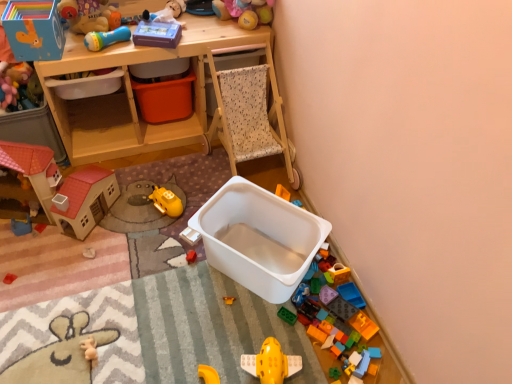
The height and width of the screenshot is (384, 512). What do you see at coordinates (132, 93) in the screenshot?
I see `wooden desk at upper center` at bounding box center [132, 93].

Image resolution: width=512 pixels, height=384 pixels. What do you see at coordinates (34, 130) in the screenshot?
I see `matte plastic storage box at left, the fourth storage box from the right` at bounding box center [34, 130].

Find the location of a particular element. matte plastic playhouse at left, positioned as the 4th toy in top-to-bottom order is located at coordinates (63, 188).

Describe the element at coordinates (21, 227) in the screenshot. The image size is (512, 384). I see `blue plastic toy at left, which appears as the fifth toy when viewed from the top` at that location.

Locate an element on the screen. orange plastic storage box at center, which ranks as the second storage box in right-to-left order is located at coordinates (165, 99).

Describe the element at coordinates (339, 273) in the screenshot. The width and height of the screenshot is (512, 384). I see `translucent plastic blocks at lower right, marked as the sixth toy in a top-to-bottom arrangement` at that location.

Measure the distance between matte cardboard box at upper left, which is the 3th toy from left to right, and camera.

They are 4.78 feet apart.

The height and width of the screenshot is (384, 512). I want to click on rubberized plastic rattle at upper left, the second toy from the top, so click(106, 38).

Is orange plastic storage box at center, which ranks as the third storage box in left-to-right order, placed right next to translucent plastic blocks at lower right, which ranks as the third toy in right-to-left order?

No, orange plastic storage box at center, which ranks as the third storage box in left-to-right order, is not in contact with translucent plastic blocks at lower right, which ranks as the third toy in right-to-left order.

Is orange plastic storage box at center, which ranks as the second storage box in right-to-left order, smaller than translucent plastic blocks at lower right, marked as the sixth toy in a top-to-bottom arrangement?

No.

Between point (142, 83) and point (328, 270), which one is positioned behind?

Positioned behind is point (142, 83).

How different are the orientations of orange plastic storage box at center, which ranks as the second storage box in right-to-left order, and translucent plastic blocks at lower right, marked as the sixth toy in a top-to-bottom arrangement, in degrees?

87.6 degrees.

Does orange plastic storage box at center, which ranks as the third storage box in left-to-right order, turn towards matte plastic playhouse at left, which is the 7th toy from bottom to top?

No, orange plastic storage box at center, which ranks as the third storage box in left-to-right order, is not aimed at matte plastic playhouse at left, which is the 7th toy from bottom to top.

Between orange plastic storage box at center, which ranks as the second storage box in right-to-left order, and matte plastic playhouse at left, marked as the 2th toy in a left-to-right arrangement, which one is positioned behind?

Positioned behind is orange plastic storage box at center, which ranks as the second storage box in right-to-left order.

Do you think orange plastic storage box at center, which ranks as the second storage box in right-to-left order, is within matte plastic playhouse at left, positioned as the 4th toy in top-to-bottom order, or outside of it?

orange plastic storage box at center, which ranks as the second storage box in right-to-left order, is outside matte plastic playhouse at left, positioned as the 4th toy in top-to-bottom order.

Does point (182, 102) come behind point (73, 232)?

Yes, it is behind point (73, 232).

Is white plastic container at lower center, the first storage box when ordered from right to left, aimed at rubberized plastic rattle at upper left, the fourth toy when ordered from left to right?

No, white plastic container at lower center, the first storage box when ordered from right to left, is not aimed at rubberized plastic rattle at upper left, the fourth toy when ordered from left to right.

Between white plastic container at lower center, the fourth storage box positioned from the left, and rubberized plastic rattle at upper left, the fourth toy when ordered from left to right, which one is positioned behind?

rubberized plastic rattle at upper left, the fourth toy when ordered from left to right.

Which point is more forward, (259,222) or (112,39)?

The point (112,39) is in front.

Does translucent plastic blocks at lower right, the 8th toy from the left, have a larger size compared to white plastic container at center-left, which is the 3th storage box in right-to-left order?

Incorrect, translucent plastic blocks at lower right, the 8th toy from the left, is not larger than white plastic container at center-left, which is the 3th storage box in right-to-left order.

Looking at this image, is translucent plastic blocks at lower right, marked as the sixth toy in a top-to-bottom arrangement, positioned far away from white plastic container at center-left, marked as the second storage box in a left-to-right arrangement?

Yes.

Would you say translucent plastic blocks at lower right, marked as the sixth toy in a top-to-bottom arrangement, is outside white plastic container at center-left, marked as the second storage box in a left-to-right arrangement?

Absolutely, translucent plastic blocks at lower right, marked as the sixth toy in a top-to-bottom arrangement, is external to white plastic container at center-left, marked as the second storage box in a left-to-right arrangement.

Which point is more distant from viewer, (215, 11) or (356, 289)?

Point (215, 11)

Is soft plush toy at upper center, acting as the tenth toy starting from the bottom, wider than translucent plastic toy blocks at lower right, positioned as the 7th toy in top-to-bottom order?

Yes, soft plush toy at upper center, acting as the tenth toy starting from the bottom, is wider than translucent plastic toy blocks at lower right, positioned as the 7th toy in top-to-bottom order.

From a real-world perspective, who is located higher, soft plush toy at upper center, acting as the tenth toy starting from the bottom, or translucent plastic toy blocks at lower right, placed as the 4th toy when sorted from bottom to top?

soft plush toy at upper center, acting as the tenth toy starting from the bottom, is physically above.

From the image's perspective, is blue plastic toy at left, which appears as the first toy when viewed from the left, under translucent plastic blocks at lower right, the first toy positioned from the right?

No.

Considering the relative sizes of blue plastic toy at left, arranged as the 6th toy when ordered from the bottom, and translucent plastic blocks at lower right, which is counted as the eighth toy, starting from the top, in the image provided, is blue plastic toy at left, arranged as the 6th toy when ordered from the bottom, shorter than translucent plastic blocks at lower right, which is counted as the eighth toy, starting from the top,?

In fact, blue plastic toy at left, arranged as the 6th toy when ordered from the bottom, may be taller than translucent plastic blocks at lower right, which is counted as the eighth toy, starting from the top.

Locate an element on the screen. toy that is the 3rd object located above the translucent plastic blocks at lower right, acting as the tenth toy starting from the left (from the image's perspective) is located at coordinates (21, 227).

Where is `storage box that is the 2nd one when counting backward from the rubberized plastic rattle at upper left, positioned as the 9th toy in bottom-to-top order`? This screenshot has height=384, width=512. storage box that is the 2nd one when counting backward from the rubberized plastic rattle at upper left, positioned as the 9th toy in bottom-to-top order is located at coordinates (87, 85).

From the image's perspective, is white plastic container at center-left, which is the 3th storage box in right-to-left order, located above or below rubberized plastic rattle at upper left, positioned as the 9th toy in bottom-to-top order?

white plastic container at center-left, which is the 3th storage box in right-to-left order, is below rubberized plastic rattle at upper left, positioned as the 9th toy in bottom-to-top order.

How many degrees apart are the facing directions of white plastic container at center-left, which is the 3th storage box in right-to-left order, and rubberized plastic rattle at upper left, the 7th toy positioned from the right?

22 degrees separate the facing orientations of white plastic container at center-left, which is the 3th storage box in right-to-left order, and rubberized plastic rattle at upper left, the 7th toy positioned from the right.

Considering the positions of objects white plastic container at center-left, marked as the second storage box in a left-to-right arrangement, and rubberized plastic rattle at upper left, the fourth toy when ordered from left to right, in the image provided, who is more to the right, white plastic container at center-left, marked as the second storage box in a left-to-right arrangement, or rubberized plastic rattle at upper left, the fourth toy when ordered from left to right,?

rubberized plastic rattle at upper left, the fourth toy when ordered from left to right, is more to the right.

From the orange plastic storage box at center, which ranks as the second storage box in right-to-left order, count 3rd toy to the right and point to it. Please provide its 2D coordinates.

[(339, 273)]

The image size is (512, 384). What are the coordinates of `the 3rd storage box behind the matte plastic playhouse at left, which is the 7th toy from bottom to top, counting from the anchor's position` in the screenshot? It's located at (165, 99).

When comparing their distances from matte plastic storage box at left, the fourth storage box from the right, does white plastic container at lower center, the first storage box when ordered from right to left, or soft plush toy at upper center, the fifth toy positioned from the right, seem closer?

Based on the image, white plastic container at lower center, the first storage box when ordered from right to left, appears to be nearer to matte plastic storage box at left, the fourth storage box from the right.

Based on their spatial positions, is white plastic container at lower center, the fourth storage box positioned from the left, or matte plastic storage box at left, the fourth storage box from the right, closer to soft plush toy at upper center, the fifth toy positioned from the right?

Among the two, white plastic container at lower center, the fourth storage box positioned from the left, is located nearer to soft plush toy at upper center, the fifth toy positioned from the right.

From the image, which object appears to be farther from translucent plastic blocks at lower right, marked as the sixth toy in a top-to-bottom arrangement, translucent plastic blocks at lower right, which is counted as the eighth toy, starting from the top, or yellow plastic airplane at center, marked as the fourth toy in a right-to-left arrangement?

yellow plastic airplane at center, marked as the fourth toy in a right-to-left arrangement, lies further to translucent plastic blocks at lower right, marked as the sixth toy in a top-to-bottom arrangement, than the other object.

Based on their spatial positions, is orange plastic storage box at center, which ranks as the third storage box in left-to-right order, or matte plastic storage box at left, which appears as the first storage box when viewed from the left, closer to soft plush toy at upper center, which appears as the 1th toy when viewed from the top?

orange plastic storage box at center, which ranks as the third storage box in left-to-right order, is closer to soft plush toy at upper center, which appears as the 1th toy when viewed from the top.

Based on their spatial positions, is light brown woven chair at center or yellow plastic airplane at center, the 7th toy in the left-to-right sequence, further from blue plastic toy at left, which appears as the first toy when viewed from the left?

yellow plastic airplane at center, the 7th toy in the left-to-right sequence, is further to blue plastic toy at left, which appears as the first toy when viewed from the left.

From the image, which object appears to be farther from blue plastic toy at left, which appears as the fifth toy when viewed from the top, wooden desk at upper center or matte plastic playhouse at left, positioned as the 4th toy in top-to-bottom order?

wooden desk at upper center lies further to blue plastic toy at left, which appears as the fifth toy when viewed from the top, than the other object.

From the image, which object appears to be nearer to orange plastic storage box at center, which ranks as the second storage box in right-to-left order, light brown woven chair at center or translucent plastic blocks at lower right, acting as the tenth toy starting from the left?

light brown woven chair at center lies closer to orange plastic storage box at center, which ranks as the second storage box in right-to-left order, than the other object.

Based on their spatial positions, is matte cardboard box at upper left, placed as the third toy when sorted from top to bottom, or white plastic container at center-left, which is the 3th storage box in right-to-left order, closer to soft plush toy at upper center, which appears as the 1th toy when viewed from the top?

white plastic container at center-left, which is the 3th storage box in right-to-left order.

Locate an element on the screen. desk that lies between soft plush toy at upper center, which is the sixth toy from left to right, and translucent plastic blocks at lower right, which ranks as the third toy in right-to-left order, from top to bottom is located at coordinates 132,93.

Find the location of a particular element. Image resolution: width=512 pixels, height=384 pixels. chair between matte plastic playhouse at left, which is the 7th toy from bottom to top, and translucent plastic toy blocks at lower right, which is the 9th toy from left to right, in the horizontal direction is located at coordinates (248, 117).

The image size is (512, 384). Identify the location of chair between wooden desk at upper center and translucent plastic blocks at lower right, the first toy positioned from the right, in the up-down direction. (248, 117).

You are a GUI agent. You are given a task and a screenshot of the screen. Output one action in this format:
    pyautogui.click(x=<x>, y=<y>)
    Task: Click on the desk between matte cardboard box at upper left, which is counted as the eighth toy, starting from the bottom, and translucent plastic blocks at lower right, the first toy positioned from the right, in the horizontal direction
    The image size is (512, 384).
    Given the screenshot: What is the action you would take?
    pos(132,93)